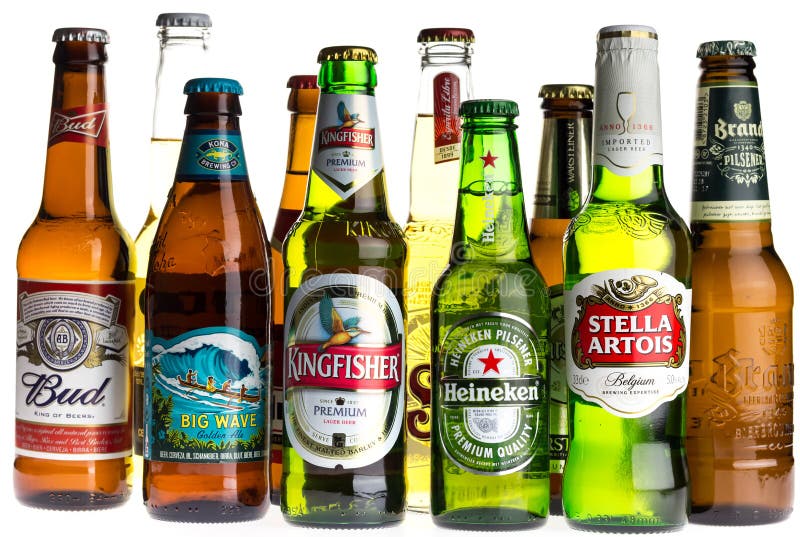
Find the location of a particular element. bottles is located at coordinates (726, 288), (650, 252), (554, 230), (502, 231), (437, 188), (364, 224), (293, 184), (206, 229), (162, 146), (77, 197).